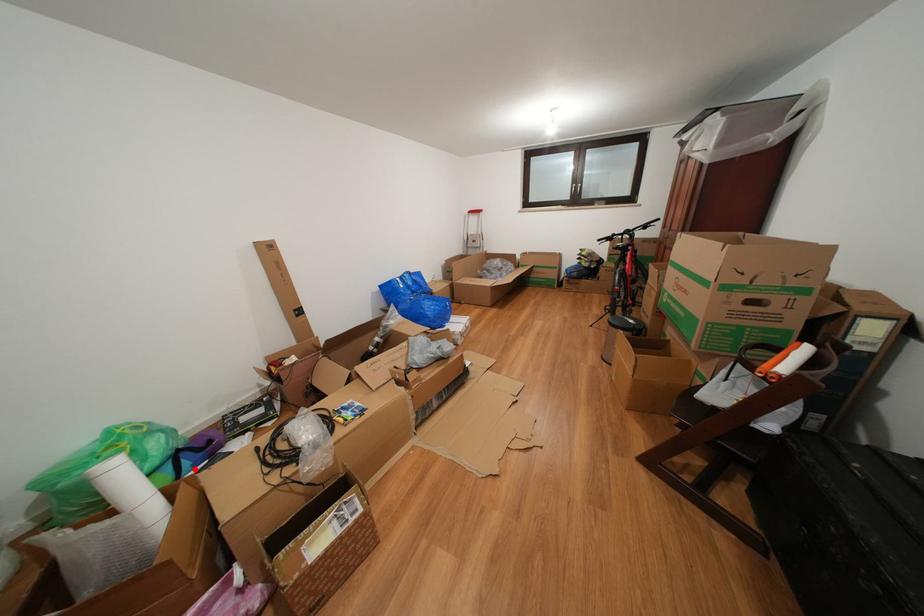
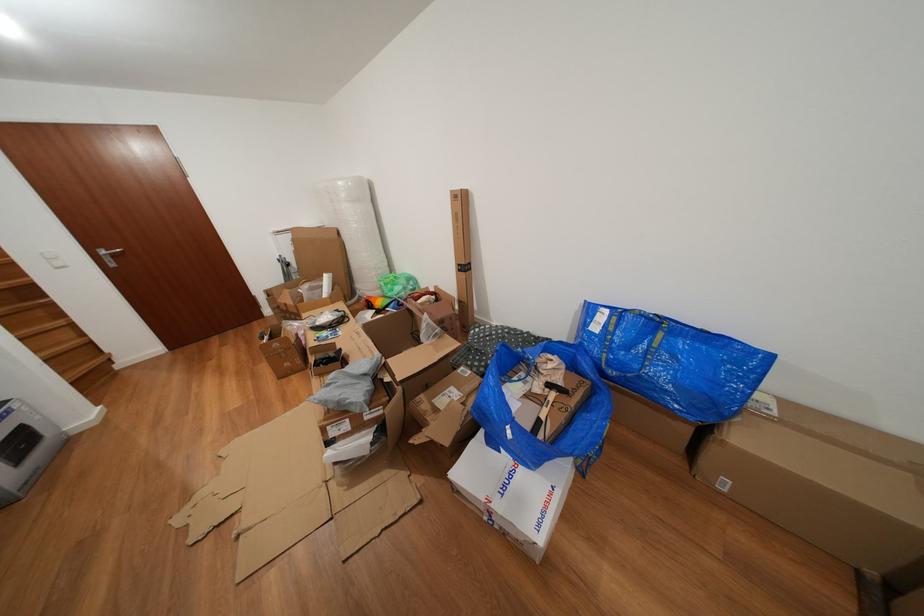
Find the pixel in the second image that matches the highlighted location in the first image.

(399, 310)